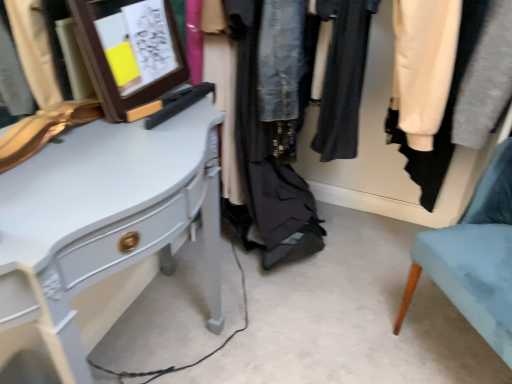
Question: Considering the positions of point (505, 225) and point (134, 41), is point (505, 225) closer or farther from the camera than point (134, 41)?

Choices:
 (A) farther
 (B) closer

Answer: (A)

Question: Considering the positions of light blue fabric chair at lower right and wooden frame at upper left in the image, is light blue fabric chair at lower right bigger or smaller than wooden frame at upper left?

Choices:
 (A) big
 (B) small

Answer: (A)

Question: Estimate the real-world distances between objects in this image. Which object is closer to the wooden frame at upper left?

Choices:
 (A) light blue fabric chair at lower right
 (B) denim jacket at center
 (C) white glossy desk at left

Answer: (C)

Question: Estimate the real-world distances between objects in this image. Which object is closer to the light blue fabric chair at lower right?

Choices:
 (A) wooden frame at upper left
 (B) denim jacket at center
 (C) white glossy desk at left

Answer: (B)